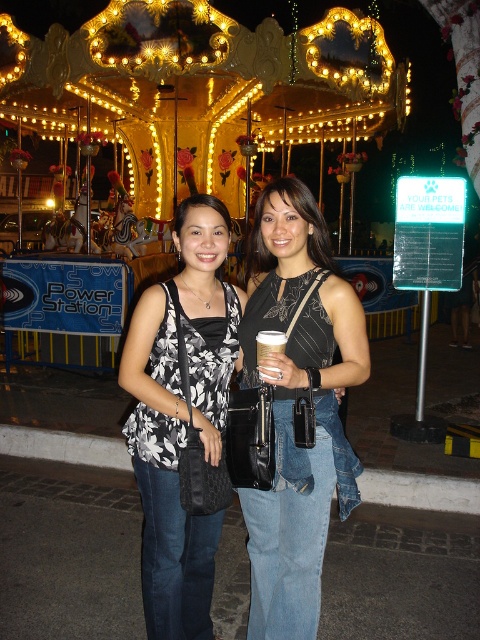
Is gold metallic carousel at upper center below black printed tank top at center?

Incorrect, gold metallic carousel at upper center is not positioned below black printed tank top at center.

Between point (2, 13) and point (123, 435), which one is positioned in front?

Point (123, 435) is in front.

What are the coordinates of `gold metallic carousel at upper center` in the screenshot? It's located at (200, 88).

Is black printed tank top at center positioned at the back of matte black dress at center?

No, it is not.

Is point (158, 432) in front of point (310, 221)?

Yes, it is.

What are the coordinates of `black printed tank top at center` in the screenshot? It's located at (180, 416).

Measure the distance between black textured dress at center and camera.

black textured dress at center is 4.25 meters away from camera.

Is point (295, 564) less distant than point (256, 339)?

Yes, point (295, 564) is closer to viewer.

This screenshot has height=640, width=480. Identify the location of black textured dress at center. tap(294, 404).